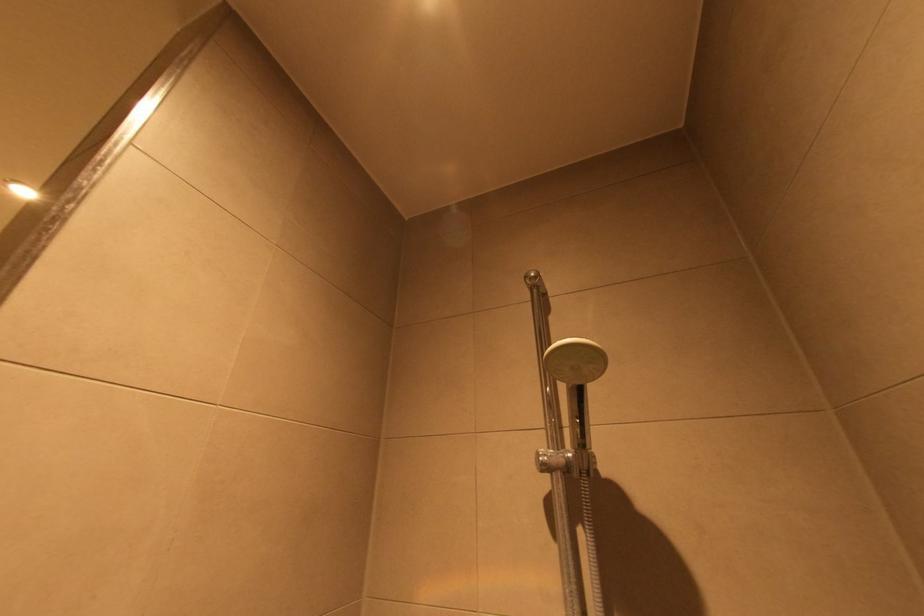
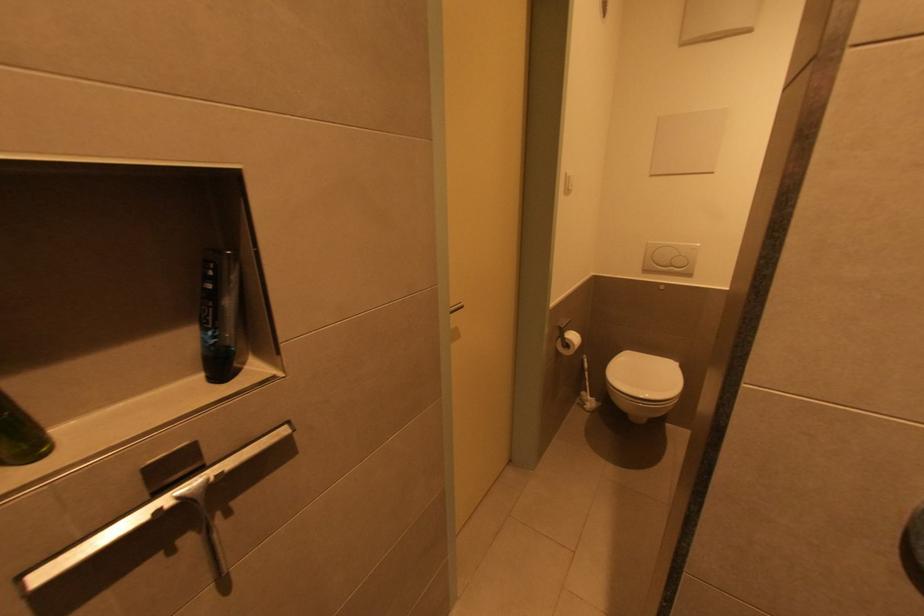
Question: The first image is from the beginning of the video and the second image is from the end. How did the camera likely rotate when shooting the video?

Choices:
 (A) Left
 (B) Right
 (C) Up
 (D) Down

Answer: (A)